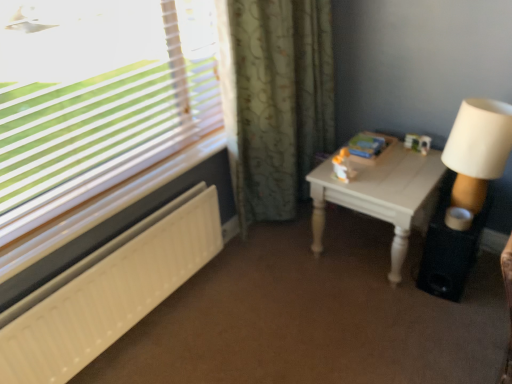
Question: From their relative heights in the image, would you say white textured radiator at lower left is taller or shorter than black matte speaker at lower right?

Choices:
 (A) short
 (B) tall

Answer: (B)

Question: Would you say white textured radiator at lower left is to the left or to the right of black matte speaker at lower right in the picture?

Choices:
 (A) right
 (B) left

Answer: (B)

Question: Estimate the real-world distances between objects in this image. Which object is closer to the white textured radiator at lower left?

Choices:
 (A) black matte speaker at lower right
 (B) green floral fabric curtain at center
 (C) white wood table at right

Answer: (B)

Question: Considering the real-world distances, which object is farthest from the green floral fabric curtain at center?

Choices:
 (A) black matte speaker at lower right
 (B) white textured radiator at lower left
 (C) white wood table at right

Answer: (A)